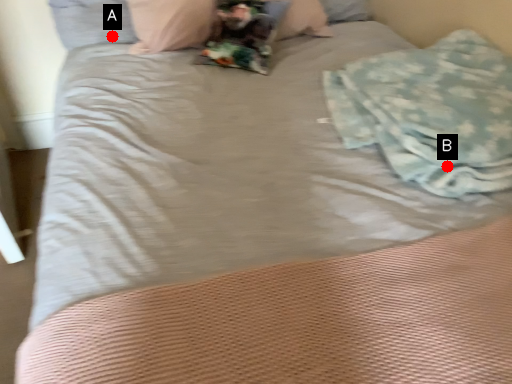
Question: Two points are circled on the image, labeled by A and B beside each circle. Which point appears farthest from the camera in this image?

Choices:
 (A) A is further
 (B) B is further

Answer: (A)